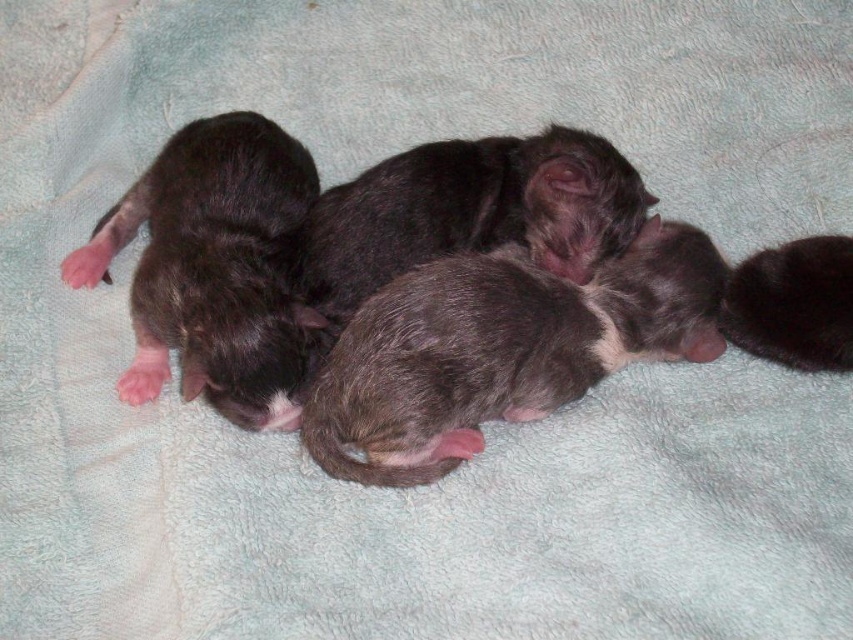
Consider the image. You are a veterinarian examining two kittens in a nursery. You notice the dark gray fur at left and the dark gray fur kitten at right. Which kitten has a larger body size?

The dark gray fur at left has a greater width than the dark gray fur kitten at right, so the dark gray fur at left is larger in size.

You are a cat owner who wants to ensure the safety of your newborn kittens. You have a small playpen that is 1.5 meters wide. If you place the point at point (527, 218) inside the playpen, will the kittens fit comfortably without overcrowding?

The kittens are 1.49 meters apart, which is slightly less than the playpen width of 1.5 meters. Therefore, placing them at point (527, 218) would allow them to fit comfortably with a small amount of space to spare.

You are a photographer standing 1.5 meters away from a light blue blanket with four newborn kittens resting on it. You want to take a closeup photo of the fuzzy black puppies at center. Can you get a clear closeup shot without moving closer than your current position?

The fuzzy black puppies at center are 1.38 meters from the viewer. Since you are currently 1.5 meters away, you can get a clear closeup shot without moving closer because the distance is sufficient for focusing.